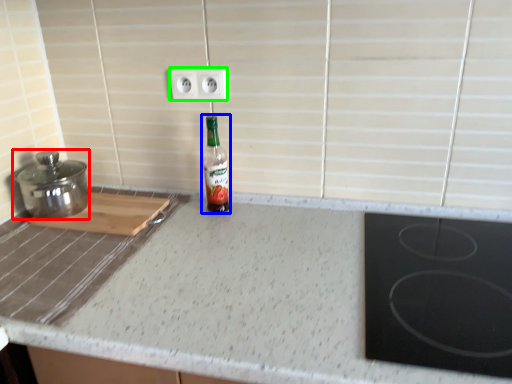
Question: Based on their relative distances, which object is farther from kitchen appliance (highlighted by a red box)? Choose from bottle (highlighted by a blue box) and electric outlet (highlighted by a green box).

Choices:
 (A) bottle
 (B) electric outlet

Answer: (B)